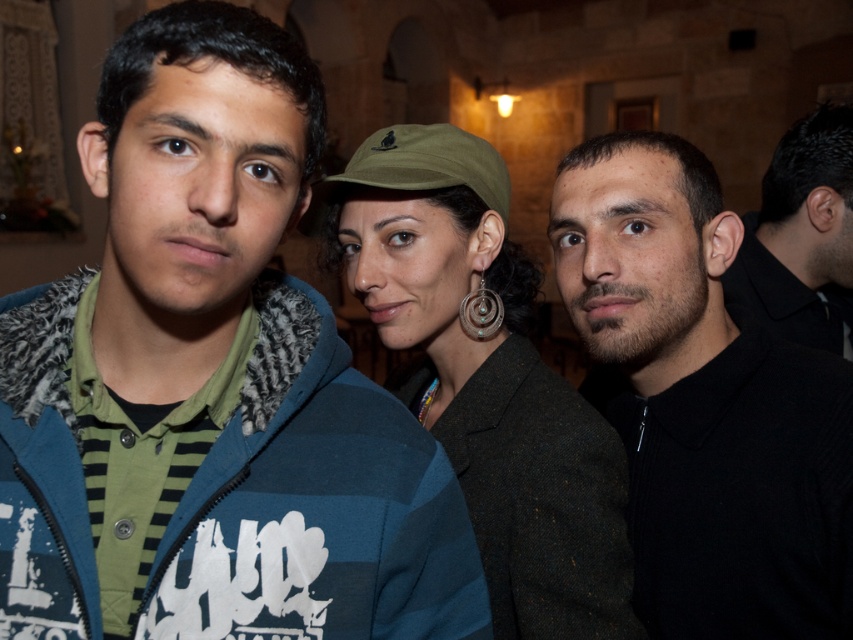
Is point (463, 412) positioned before point (750, 252)?

That is True.

Describe the element at coordinates (486, 378) in the screenshot. I see `green fabric cap at center` at that location.

Locate an element on the screen. Image resolution: width=853 pixels, height=640 pixels. green fabric cap at center is located at coordinates (486, 378).

Does blue striped hoodie at center appear on the left side of black matte shirt at center?

Correct, you'll find blue striped hoodie at center to the left of black matte shirt at center.

Is blue striped hoodie at center shorter than black matte shirt at center?

Correct, blue striped hoodie at center is not as tall as black matte shirt at center.

The width and height of the screenshot is (853, 640). I want to click on blue striped hoodie at center, so click(254, 355).

Is black matte shirt at center shorter than green fabric cap at center?

Indeed, black matte shirt at center has a lesser height compared to green fabric cap at center.

Which is above, black matte shirt at center or green fabric cap at center?

green fabric cap at center

Is point (831, 422) closer to camera compared to point (503, 179)?

That is True.

Where is `black matte shirt at center`? black matte shirt at center is located at coordinates (704, 403).